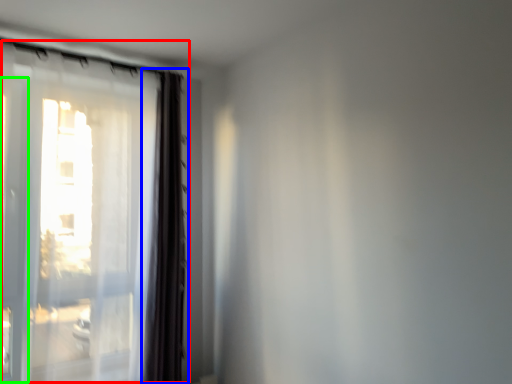
Question: Considering the real-world distances, which object is farthest from window (highlighted by a red box)? curtain (highlighted by a blue box) or screen door (highlighted by a green box)?

Choices:
 (A) curtain
 (B) screen door

Answer: (B)